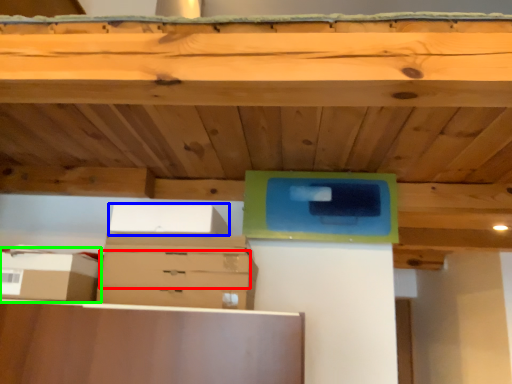
Question: Based on their relative distances, which object is nearer to drawer (highlighted by a red box)? Choose from storage box (highlighted by a blue box) and storage box (highlighted by a green box).

Choices:
 (A) storage box
 (B) storage box

Answer: (A)